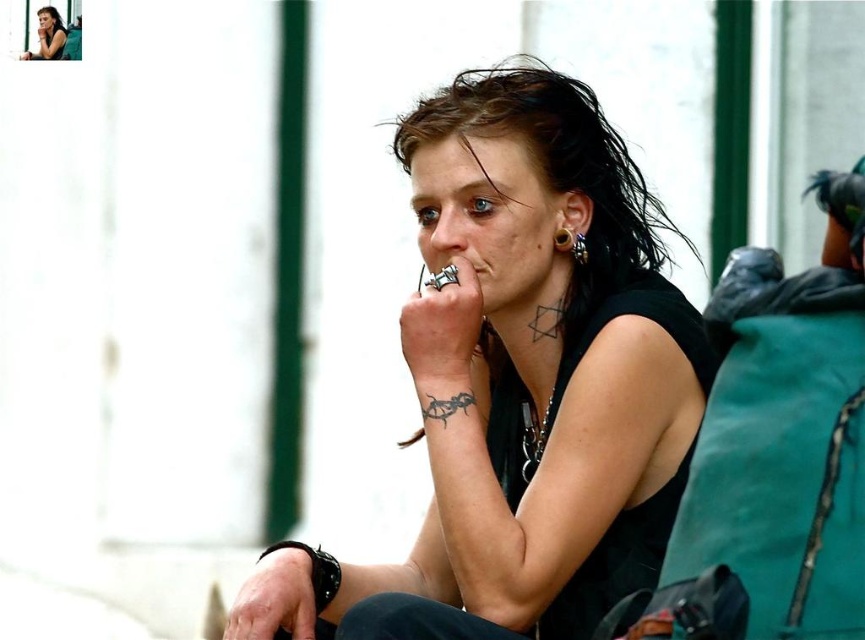
Does point (50, 29) come in front of point (556, 240)?

No, (50, 29) is behind (556, 240).

What are the coordinates of `dark brown hair at upper left` in the screenshot? It's located at (49, 22).

Where is `dark brown hair at upper left`? The width and height of the screenshot is (865, 640). dark brown hair at upper left is located at coordinates (49, 22).

Is point (50, 13) positioned behind point (555, 248)?

Yes, it is.

Does point (62, 42) come in front of point (567, 228)?

No, (62, 42) is behind (567, 228).

Between point (47, 51) and point (571, 230), which one is positioned in front?

Positioned in front is point (571, 230).

The width and height of the screenshot is (865, 640). Find the location of `matte black tank top at center`. matte black tank top at center is located at coordinates (48, 35).

Is matte black shirt at center below gold textured ring at ear?

Yes.

Who is more distant from viewer, (x=597, y=403) or (x=572, y=237)?

The point (x=572, y=237) is more distant.

Does point (569, 182) come farther from viewer compared to point (556, 244)?

No, (569, 182) is in front of (556, 244).

In order to click on matte black shirt at center in this screenshot , I will do `click(530, 374)`.